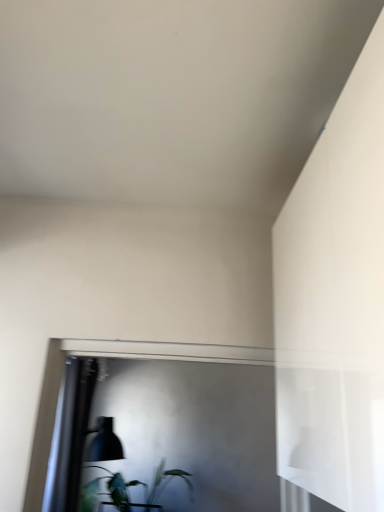
The width and height of the screenshot is (384, 512). Identify the location of matte black lampshade at lower left. (104, 468).

Describe the element at coordinates (104, 468) in the screenshot. This screenshot has height=512, width=384. I see `matte black lampshade at lower left` at that location.

The height and width of the screenshot is (512, 384). Describe the element at coordinates (128, 488) in the screenshot. I see `green leafy plant at lower left` at that location.

Identify the location of green leafy plant at lower left. (128, 488).

In order to click on matte black lampshade at lower left in this screenshot , I will do `click(104, 468)`.

Would you say green leafy plant at lower left is to the left or to the right of matte black lampshade at lower left in the picture?

green leafy plant at lower left is to the right of matte black lampshade at lower left.

Between green leafy plant at lower left and matte black lampshade at lower left, which one is positioned behind?

green leafy plant at lower left is further from the camera.

Is point (159, 487) farther from camera compared to point (81, 508)?

No, (159, 487) is in front of (81, 508).

From the image's perspective, is green leafy plant at lower left above or below matte black lampshade at lower left?

Based on their image positions, green leafy plant at lower left is located beneath matte black lampshade at lower left.

From a real-world perspective, which is physically above, green leafy plant at lower left or matte black lampshade at lower left?

matte black lampshade at lower left.

Considering the relative sizes of green leafy plant at lower left and matte black lampshade at lower left in the image provided, is green leafy plant at lower left wider than matte black lampshade at lower left?

Yes.

Is green leafy plant at lower left taller or shorter than matte black lampshade at lower left?

Considering their sizes, green leafy plant at lower left has less height than matte black lampshade at lower left.

Considering the relative sizes of green leafy plant at lower left and matte black lampshade at lower left in the image provided, is green leafy plant at lower left smaller than matte black lampshade at lower left?

Actually, green leafy plant at lower left might be larger than matte black lampshade at lower left.

Is green leafy plant at lower left surrounding matte black lampshade at lower left?

No, matte black lampshade at lower left is located outside of green leafy plant at lower left.

Is there a large distance between green leafy plant at lower left and matte black lampshade at lower left?

green leafy plant at lower left is near matte black lampshade at lower left, not far away.

Is green leafy plant at lower left facing towards matte black lampshade at lower left?

Yes, green leafy plant at lower left is oriented towards matte black lampshade at lower left.

How far apart are green leafy plant at lower left and matte black lampshade at lower left?

green leafy plant at lower left and matte black lampshade at lower left are 5.44 inches apart from each other.

The width and height of the screenshot is (384, 512). Identify the location of table lamp above the green leafy plant at lower left (from the image's perspective). (104, 468).

Considering the positions of objects matte black lampshade at lower left and green leafy plant at lower left in the image provided, who is more to the left, matte black lampshade at lower left or green leafy plant at lower left?

matte black lampshade at lower left.

Considering the relative positions of matte black lampshade at lower left and green leafy plant at lower left in the image provided, is matte black lampshade at lower left in front of green leafy plant at lower left?

Yes, the depth of matte black lampshade at lower left is less than that of green leafy plant at lower left.

Considering the positions of point (89, 459) and point (151, 492), is point (89, 459) closer or farther from the camera than point (151, 492)?

Point (89, 459) is positioned farther from the camera compared to point (151, 492).

From the image's perspective, who appears lower, matte black lampshade at lower left or green leafy plant at lower left?

green leafy plant at lower left appears lower in the image.

From a real-world perspective, is matte black lampshade at lower left on green leafy plant at lower left?

Yes, from a real-world perspective, matte black lampshade at lower left is above green leafy plant at lower left.

Does matte black lampshade at lower left have a greater width compared to green leafy plant at lower left?

Incorrect, the width of matte black lampshade at lower left does not surpass that of green leafy plant at lower left.

Is matte black lampshade at lower left taller than green leafy plant at lower left?

Indeed, matte black lampshade at lower left has a greater height compared to green leafy plant at lower left.

Considering the sizes of objects matte black lampshade at lower left and green leafy plant at lower left in the image provided, who is bigger, matte black lampshade at lower left or green leafy plant at lower left?

green leafy plant at lower left is bigger.

Is matte black lampshade at lower left positioned beyond the bounds of green leafy plant at lower left?

Yes, matte black lampshade at lower left is outside of green leafy plant at lower left.

Is matte black lampshade at lower left with green leafy plant at lower left?

No.

Is matte black lampshade at lower left positioned with its back to green leafy plant at lower left?

No.

How far apart are matte black lampshade at lower left and green leafy plant at lower left?

They are 13.82 centimeters apart.

The image size is (384, 512). I want to click on houseplant below the matte black lampshade at lower left (from a real-world perspective), so click(x=128, y=488).

Locate an element on the screen. table lamp above the green leafy plant at lower left (from a real-world perspective) is located at coordinates (104, 468).

Where is `table lamp located above the green leafy plant at lower left (from the image's perspective)`? This screenshot has height=512, width=384. table lamp located above the green leafy plant at lower left (from the image's perspective) is located at coordinates (104, 468).